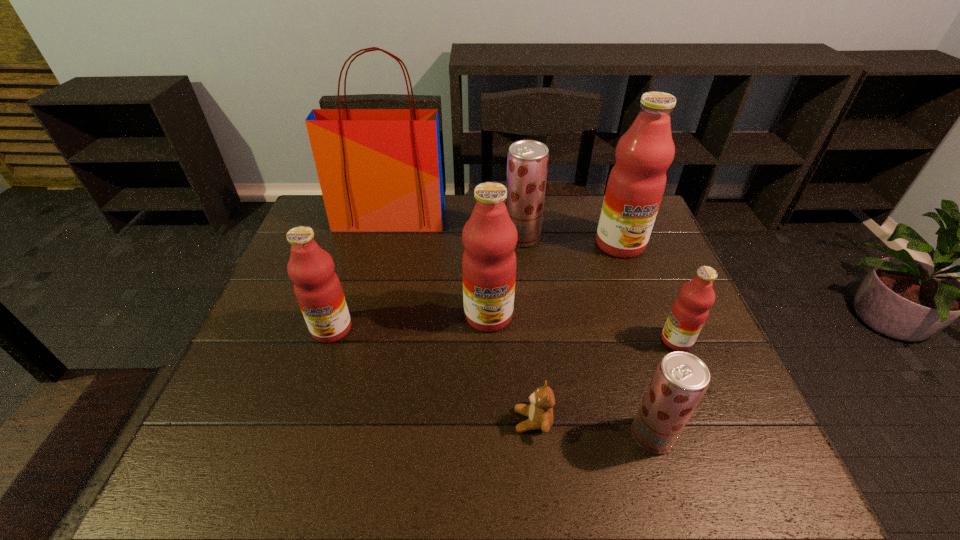
Locate an element on the screen. object at the far left corner is located at coordinates (380, 170).

Find the location of a particular element. The height and width of the screenshot is (540, 960). object that is at the far right corner is located at coordinates (636, 184).

In the image, there is a desktop. At what (x,y) coordinates should I click in order to perform the action: click on free space at the far edge. Please return your answer as a coordinate pair (x, y). Looking at the image, I should click on (589, 200).

Locate an element on the screen. vacant area at the left edge of the desktop is located at coordinates (252, 404).

The image size is (960, 540). In the image, there is a desktop. Identify the location of vacant space at the right edge. (648, 273).

At what (x,y) coordinates should I click in order to perform the action: click on vacant space at the near left corner of the desktop. Please return your answer as a coordinate pair (x, y). The height and width of the screenshot is (540, 960). Looking at the image, I should click on (240, 448).

Image resolution: width=960 pixels, height=540 pixels. In order to click on blank region between the farther strawberry fruit juice and the tallest fruit juice in this screenshot , I will do `click(571, 241)`.

Locate an element on the screen. free space between the smallest pink fruit juice and the second tallest fruit juice is located at coordinates (583, 328).

The height and width of the screenshot is (540, 960). I want to click on vacant space that is in between the teddy bear and the shopping bag, so click(x=462, y=320).

You are a GUI agent. You are given a task and a screenshot of the screen. Output one action in this format:
    pyautogui.click(x=<x>, y=<y>)
    Task: Click on the free space between the farther strawberry fruit juice and the teddy bear
    The height and width of the screenshot is (540, 960).
    Given the screenshot: What is the action you would take?
    pyautogui.click(x=527, y=329)